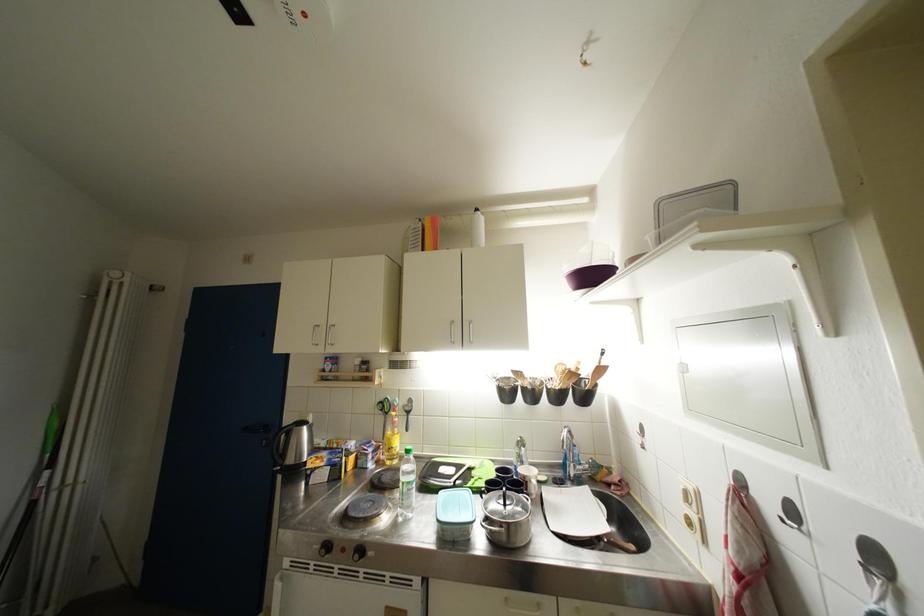
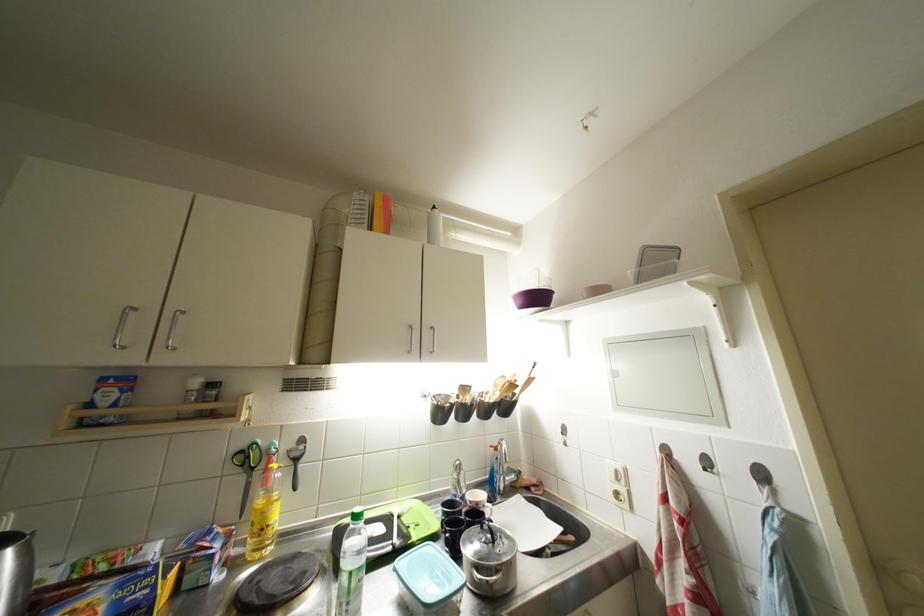
Question: I am providing you with two images of the same scene from different viewpoints. Please identify which objects are invisible in image2.

Choices:
 (A) white plastic bottle
 (B) metal pot side handle
 (C) silver cabinet handle
 (D) none of these

Answer: (D)